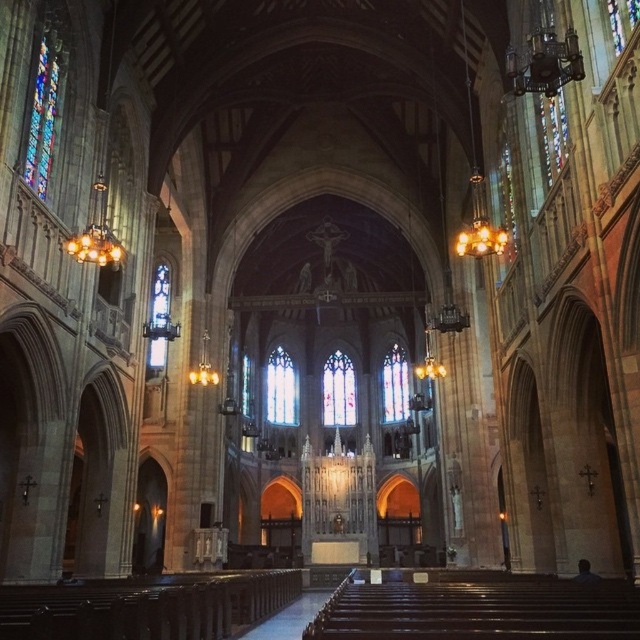
You are a visitor standing at the entrance of the cathedral. You see the translucent stained glass at center and the stained glass window at center. Which one is closer to you?

The translucent stained glass at center is closer to you than the stained glass window at center because the distance between them is 34.09 meters, meaning the translucent stained glass is nearer.

You are an architect visiting the cathedral and want to take a photo of both stained glass window at upper left and stained glass at center. Which one should you focus on first to ensure both are in the frame?

You should focus on the stained glass at center first because the stained glass window at upper left is in front of it, so adjusting the focus to include the background stained glass at center will help both be in the frame.

You are standing inside the cathedral and notice two points marked in the scene. The first point is at coordinates point (157,340), and the second is at point (243,380). Which of these two points is closer to your current position?

Point (157,340) is closer to the camera than point (243,380), so the first point is closer to your current position.